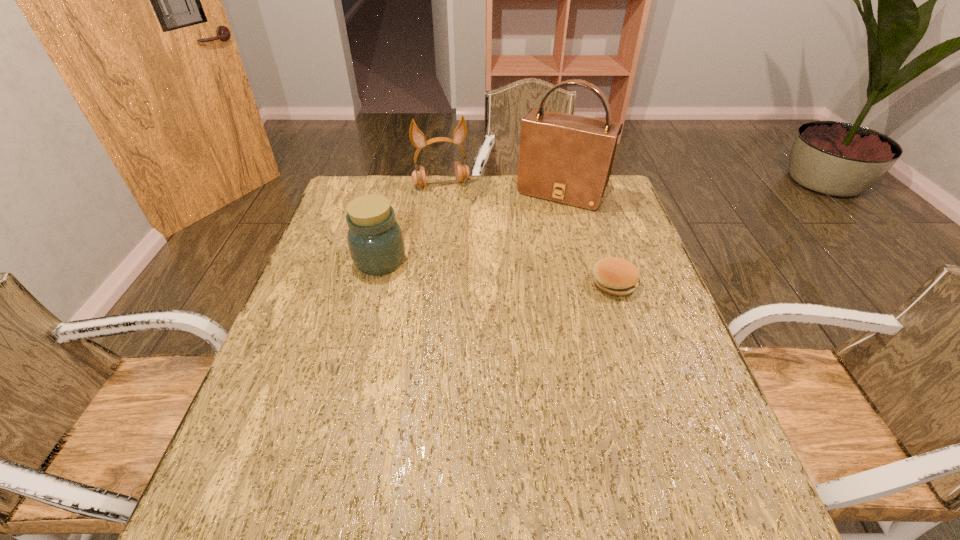
I want to click on vacant space on the desktop that is between the jar and the patty and is positioned on the front-facing side of the second tallest object, so click(470, 269).

Find the location of `free space on the desktop that is between the jar and the patty and is positioned on the front flap of the tallest object`. free space on the desktop that is between the jar and the patty and is positioned on the front flap of the tallest object is located at coordinates (516, 274).